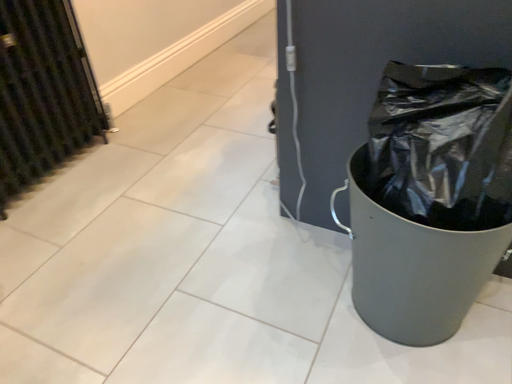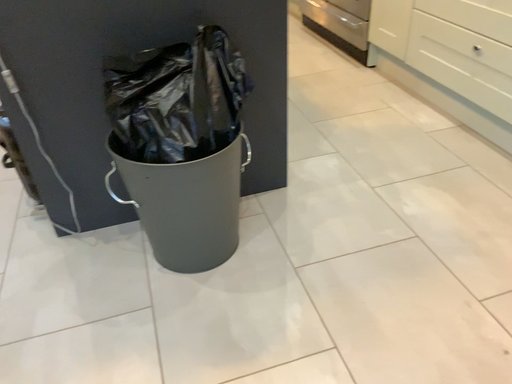
Question: How did the camera likely rotate when shooting the video?

Choices:
 (A) rotated right
 (B) rotated left

Answer: (A)